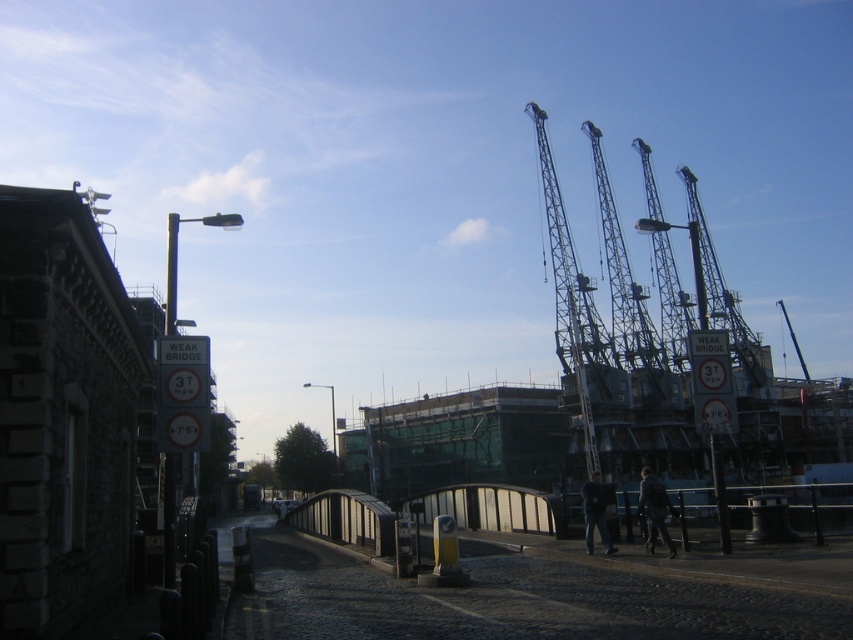
You are driving a truck that is 3 meters wide. You need to cross the small pedestrian bridge and must pass between the metallic gray crane at center and the metallic gray crane at upper right. Can your truck fit through the gap between them?

The metallic gray crane at center is positioned on the left side of metallic gray crane at upper right, so the gap between them is sufficient for a 3 meter wide truck to pass through.

You are driving a truck that is 15 meters tall. You see the metallic gray crane at center and the metallic gray crane at upper right in the distance. Which crane do you need to avoid hitting with your truck?

You need to avoid hitting the metallic gray crane at center because it is much taller than the metallic gray crane at upper right, and your truck is 15 meters tall which may exceed the height limit.

You are driving a truck that is 12 meters long. You need to pass between the two metallic gray crane at center and metallic gray crane at upper right. Is there enough space for your truck to fit through?

The distance between the metallic gray crane at center and the metallic gray crane at upper right is 13.72 meters, which is longer than the truck length of 12 meters. Therefore, the truck can safely pass through the space between them.